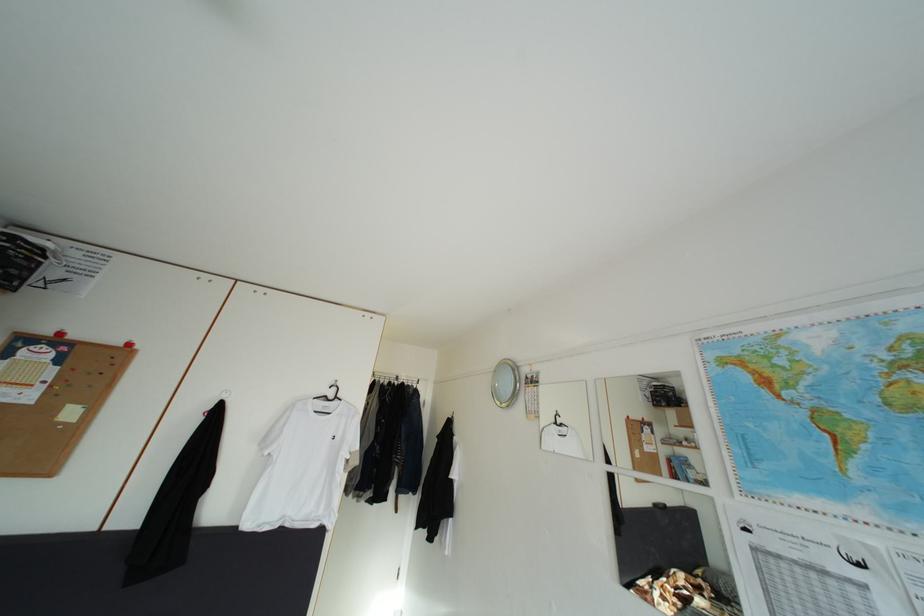
In order to click on metal wall hook in this screenshot , I will do `click(556, 419)`.